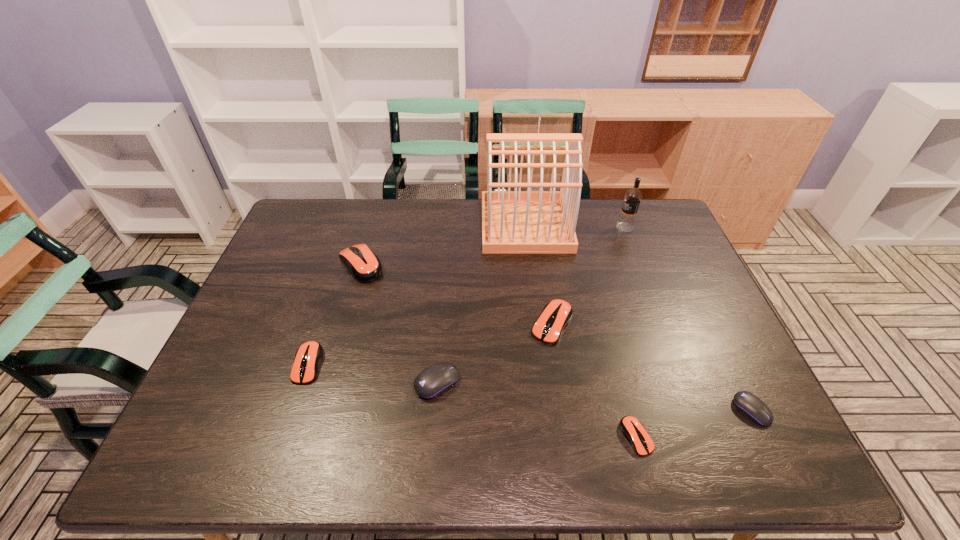
You are a GUI agent. You are given a task and a screenshot of the screen. Output one action in this format:
    pyautogui.click(x=<x>, y=<y>)
    Task: Click on the vacant space located 0.220m on the label of the seventh shortest object
    This screenshot has width=960, height=540.
    Given the screenshot: What is the action you would take?
    pyautogui.click(x=552, y=227)

Where is `vacant region located 0.080m on the back of the biggest orange computer mouse`? vacant region located 0.080m on the back of the biggest orange computer mouse is located at coordinates (371, 232).

Where is `vacant region located 0.100m on the left of the third computer mouse from right to left`? vacant region located 0.100m on the left of the third computer mouse from right to left is located at coordinates (493, 325).

At what (x,y) coordinates should I click in order to perform the action: click on vacant space situated on the front of the fourth computer mouse from right to left. Please return your answer as a coordinate pair (x, y). Looking at the image, I should click on (433, 442).

I want to click on free space located 0.400m on the back of the third biggest orange computer mouse, so click(x=348, y=246).

Where is `free space located on the back of the smaller black computer mouse`? This screenshot has height=540, width=960. free space located on the back of the smaller black computer mouse is located at coordinates (726, 356).

Locate an element on the screen. free space located on the left of the shortest computer mouse is located at coordinates (521, 437).

Image resolution: width=960 pixels, height=540 pixels. Find the location of `birdcage located at the far edge`. birdcage located at the far edge is located at coordinates (513, 222).

Find the location of `vodka that is positioned at the far edge`. vodka that is positioned at the far edge is located at coordinates (626, 222).

The height and width of the screenshot is (540, 960). In order to click on object positioned at the near edge in this screenshot , I will do `click(633, 430)`.